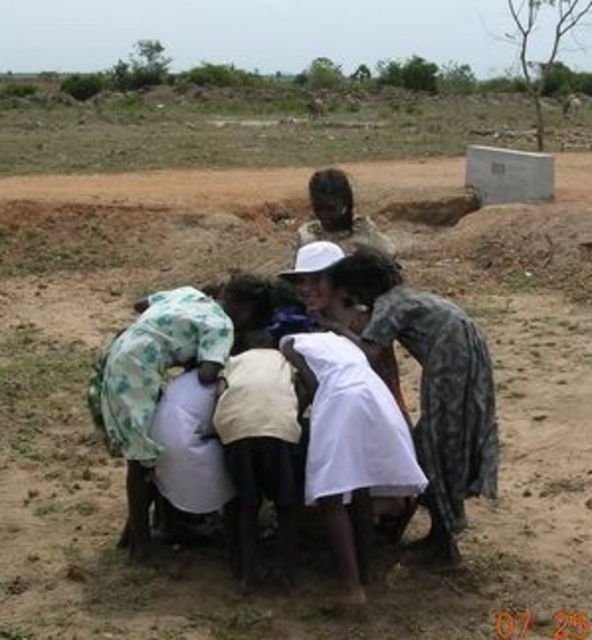
Question: Does white cloth at center appear under white clothed person at center?

Choices:
 (A) no
 (B) yes

Answer: (B)

Question: Which of the following is the farthest from the observer?

Choices:
 (A) white clothed person at center
 (B) white cloth at center

Answer: (A)

Question: Which object is farther from the camera taking this photo?

Choices:
 (A) white cloth at center
 (B) white clothed person at center

Answer: (B)

Question: Can you confirm if white cloth at center is smaller than white clothed person at center?

Choices:
 (A) yes
 (B) no

Answer: (A)

Question: Is white cloth at center bigger than white clothed person at center?

Choices:
 (A) no
 (B) yes

Answer: (A)